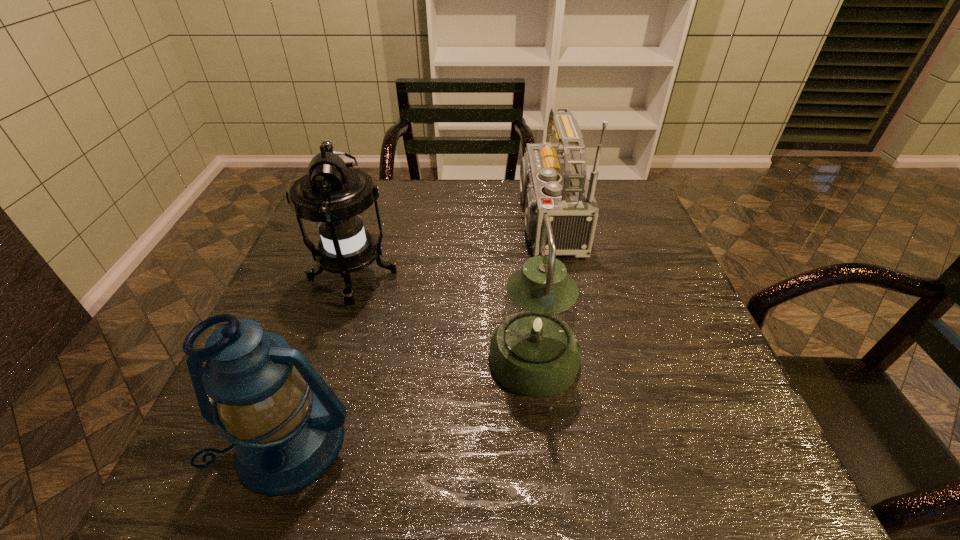
Identify the location of object present at the near left corner. (256, 386).

In the image, there is a desktop. In order to click on vacant space at the far edge in this screenshot , I will do `click(479, 207)`.

Image resolution: width=960 pixels, height=540 pixels. Identify the location of blank space at the left edge of the desktop. (304, 255).

This screenshot has height=540, width=960. What are the coordinates of `vacant space at the right edge of the desktop` in the screenshot? It's located at (679, 300).

Where is `blank region between the farthest lantern and the radio receiver`? The height and width of the screenshot is (540, 960). blank region between the farthest lantern and the radio receiver is located at coordinates (447, 249).

Where is `empty space between the radio receiver and the farthest lantern`? empty space between the radio receiver and the farthest lantern is located at coordinates pos(447,249).

Identify the location of free space that is in between the rightmost lantern and the farthest lantern. This screenshot has width=960, height=540. (444, 318).

Where is `object that is the second nearest to the farthest lantern`? Image resolution: width=960 pixels, height=540 pixels. object that is the second nearest to the farthest lantern is located at coordinates (534, 353).

Locate which object is the third closest to the rightmost lantern. Please provide its 2D coordinates. Your answer should be formatted as a tuple, i.e. [(x, y)], where the tuple contains the x and y coordinates of a point satisfying the conditions above.

[(256, 386)]

Point out which lantern is positioned as the nearest to the farthest lantern. Please provide its 2D coordinates. Your answer should be formatted as a tuple, i.e. [(x, y)], where the tuple contains the x and y coordinates of a point satisfying the conditions above.

[(256, 386)]